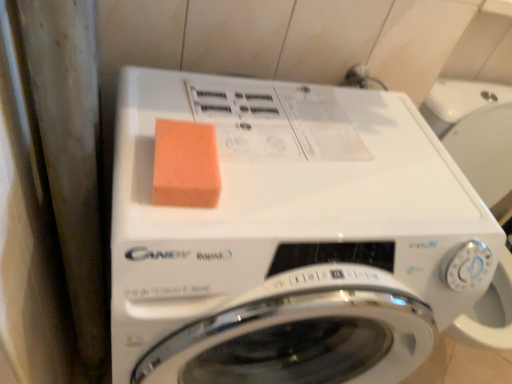
Identify the location of free space to the back side of orange sponge at upper center. The width and height of the screenshot is (512, 384). (223, 108).